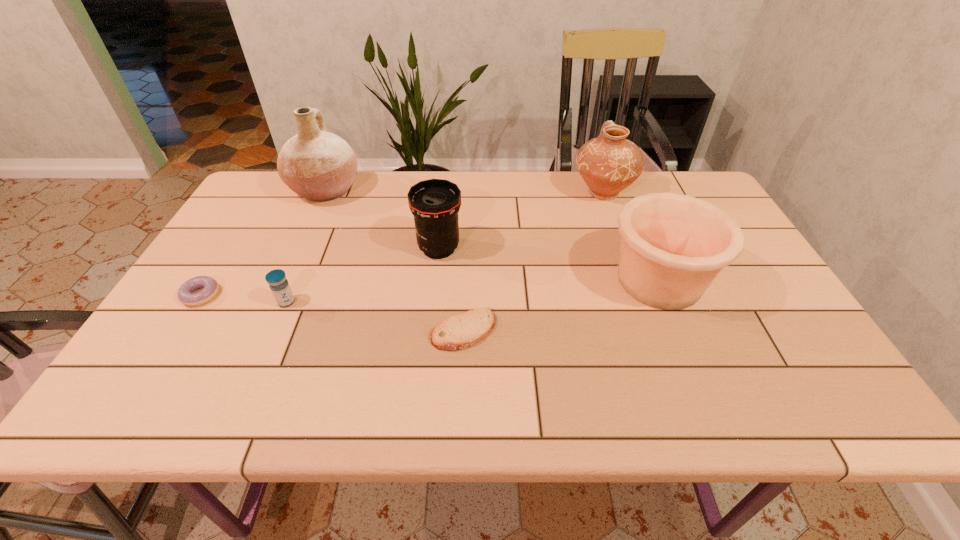
Locate an element on the screen. Image resolution: width=960 pixels, height=540 pixels. the leftmost pottery is located at coordinates point(320,166).

The image size is (960, 540). Identify the location of the tallest pottery. (320, 166).

Image resolution: width=960 pixels, height=540 pixels. What are the coordinates of `the second tallest pottery` in the screenshot? It's located at (609, 163).

Where is `telephoto lens`? telephoto lens is located at coordinates (435, 203).

The image size is (960, 540). I want to click on the shortest pottery, so click(x=673, y=246).

Find the location of a particular element. The width and height of the screenshot is (960, 540). medicine is located at coordinates (280, 288).

This screenshot has height=540, width=960. Identify the location of the leftmost object. (185, 294).

At what (x,y) coordinates should I click in order to perform the action: click on pita bread. Please return your answer as a coordinate pair (x, y). Looking at the image, I should click on (465, 329).

You are a GUI agent. You are given a task and a screenshot of the screen. Output one action in this format:
    pyautogui.click(x=<x>, y=<y>)
    Task: Click on the vacant region located to pour from the handle of the tallest pottery
    
    Given the screenshot: What is the action you would take?
    pos(380,190)

Where is `free space located 0.200m on the left of the telephoto lens`? free space located 0.200m on the left of the telephoto lens is located at coordinates (342, 248).